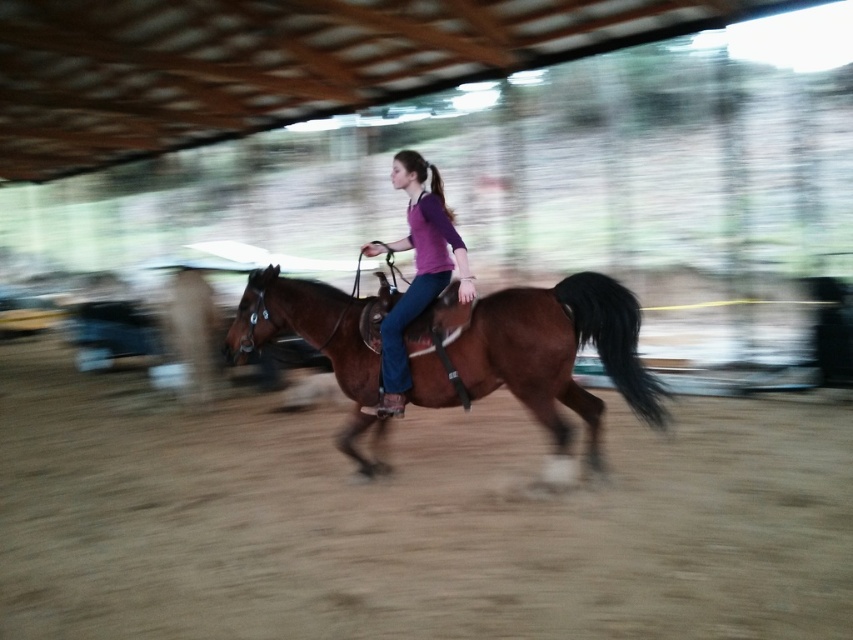
Question: Which object is positioned farthest from the purple matte shirt at center?

Choices:
 (A) brown leather horse at center
 (B) brown sandy dirt track at center

Answer: (B)

Question: Which object appears farthest from the camera in this image?

Choices:
 (A) brown sandy dirt track at center
 (B) purple matte shirt at center

Answer: (B)

Question: Does brown sandy dirt track at center have a smaller size compared to purple matte shirt at center?

Choices:
 (A) yes
 (B) no

Answer: (A)

Question: Which point is farther from the camera taking this photo?

Choices:
 (A) (440, 182)
 (B) (750, 500)
 (C) (564, 369)

Answer: (A)

Question: Can you confirm if brown leather horse at center is wider than purple matte shirt at center?

Choices:
 (A) no
 (B) yes

Answer: (B)

Question: Does brown leather horse at center lie in front of purple matte shirt at center?

Choices:
 (A) no
 (B) yes

Answer: (B)